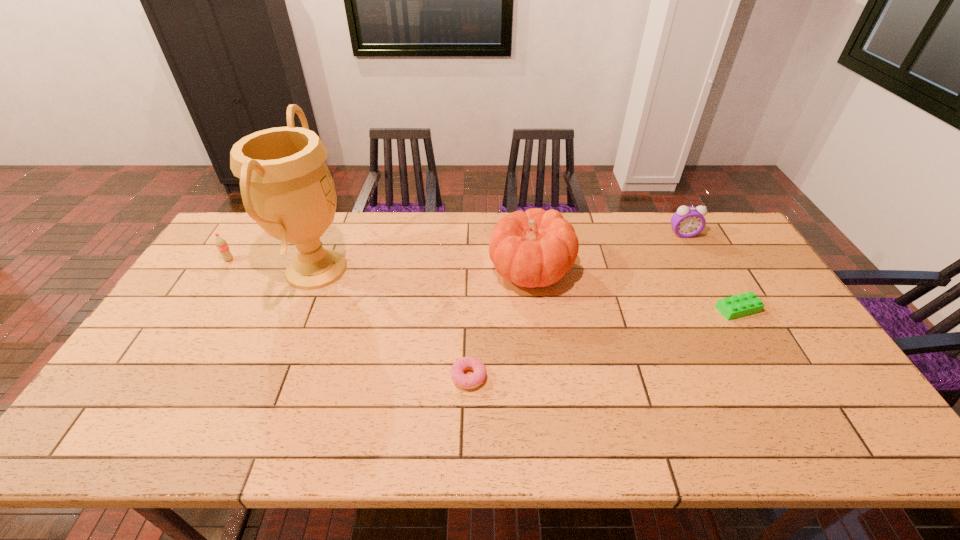
At what (x,y) coordinates should I click in order to perform the action: click on free space that satisfies the following two spatial constraints: 1. on the back side of the fourth object from right to left; 2. on the engravings side of the trophy. Please return your answer as a coordinate pair (x, y). Image resolution: width=960 pixels, height=540 pixels. Looking at the image, I should click on (471, 269).

Locate an element on the screen. vacant space that satisfies the following two spatial constraints: 1. on the face of the Lego; 2. on the left side of the alarm clock is located at coordinates (725, 309).

Locate an element on the screen. Image resolution: width=960 pixels, height=540 pixels. free space in the image that satisfies the following two spatial constraints: 1. on the face of the alarm clock; 2. on the right side of the Lego is located at coordinates (725, 309).

This screenshot has height=540, width=960. What are the coordinates of `free point that satisfies the following two spatial constraints: 1. on the engravings side of the tallest object; 2. on the left side of the second tallest object` in the screenshot? It's located at (316, 270).

Locate an element on the screen. The height and width of the screenshot is (540, 960). free spot that satisfies the following two spatial constraints: 1. on the face of the Lego; 2. on the left side of the alarm clock is located at coordinates (725, 309).

The width and height of the screenshot is (960, 540). I want to click on free space that satisfies the following two spatial constraints: 1. on the engravings side of the Lego; 2. on the left side of the fifth object from right to left, so click(300, 309).

At what (x,y) coordinates should I click in order to perform the action: click on free location that satisfies the following two spatial constraints: 1. on the engravings side of the nearest object; 2. on the left side of the trophy. Please return your answer as a coordinate pair (x, y). This screenshot has width=960, height=540. Looking at the image, I should click on (273, 377).